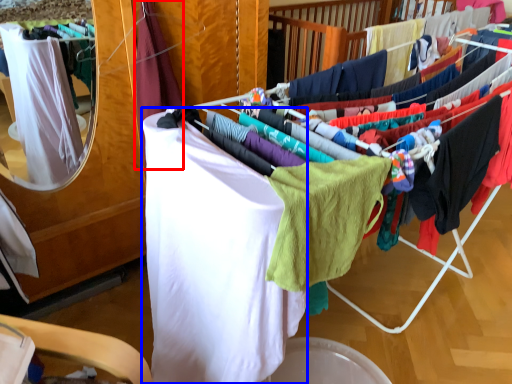
Question: Which of the following is the farthest to the observer, clothing (highlighted by a red box) or clothing (highlighted by a blue box)?

Choices:
 (A) clothing
 (B) clothing

Answer: (A)